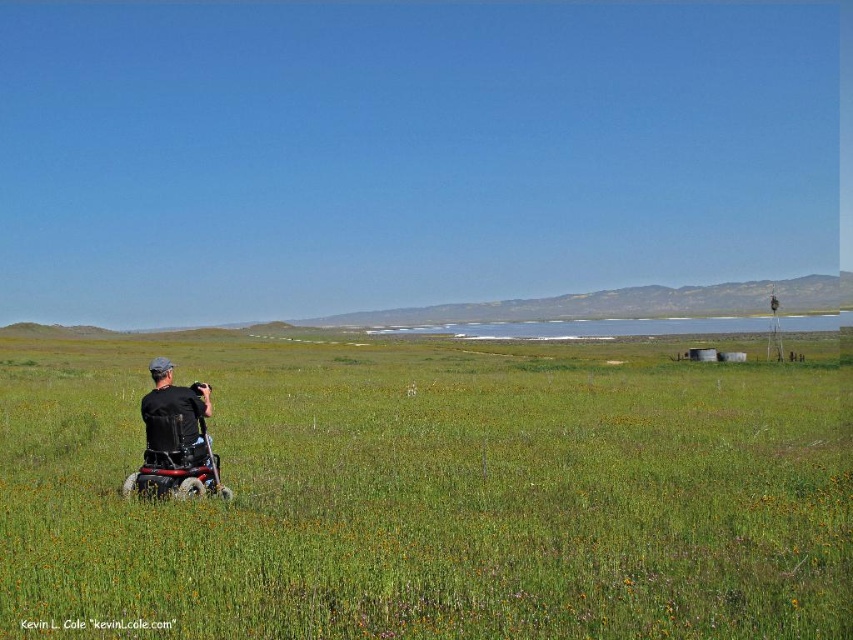
This screenshot has height=640, width=853. What do you see at coordinates (175, 461) in the screenshot? I see `black plastic wheelchair at lower left` at bounding box center [175, 461].

Between black plastic wheelchair at lower left and black matte wheelchair at lower left, which one has more height?

black matte wheelchair at lower left

Who is more forward, (202, 445) or (164, 444)?

Positioned in front is point (164, 444).

Where is `black plastic wheelchair at lower left`? The width and height of the screenshot is (853, 640). black plastic wheelchair at lower left is located at coordinates (175, 461).

Does point (218, 588) lie behind point (161, 426)?

No, (218, 588) is in front of (161, 426).

Between green grassy field at center and black plastic wheelchair at lower left, which one has more height?

With more height is green grassy field at center.

Image resolution: width=853 pixels, height=640 pixels. Describe the element at coordinates (431, 493) in the screenshot. I see `green grassy field at center` at that location.

The height and width of the screenshot is (640, 853). In order to click on green grassy field at center in this screenshot , I will do `click(431, 493)`.

Who is more distant from viewer, (519, 470) or (155, 378)?

Positioned behind is point (519, 470).

Is the position of green grassy field at center more distant than that of black matte wheelchair at lower left?

No.

Which is behind, point (91, 474) or point (196, 388)?

The point (91, 474) is behind.

At what (x,y) coordinates should I click in order to perform the action: click on green grassy field at center. Please return your answer as a coordinate pair (x, y). The height and width of the screenshot is (640, 853). Looking at the image, I should click on (431, 493).